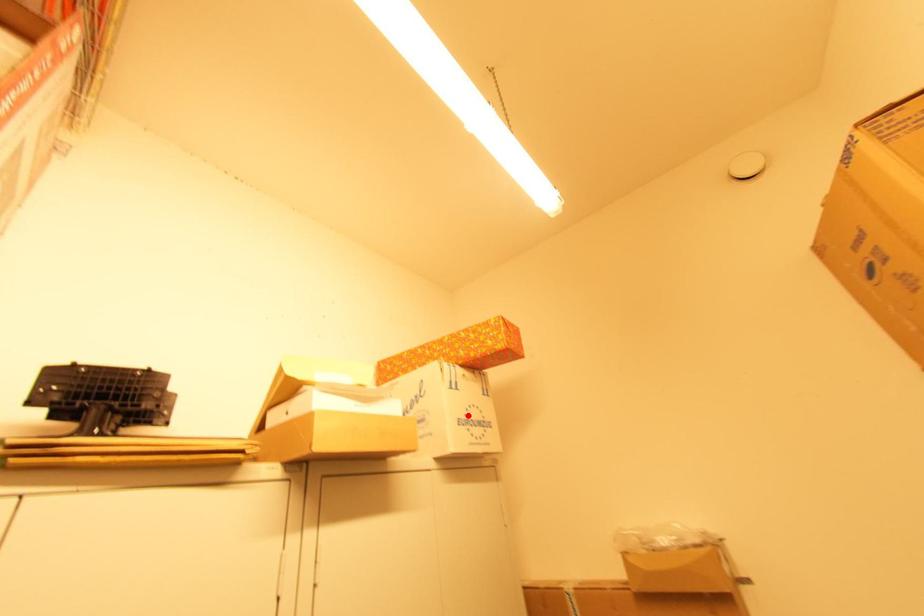
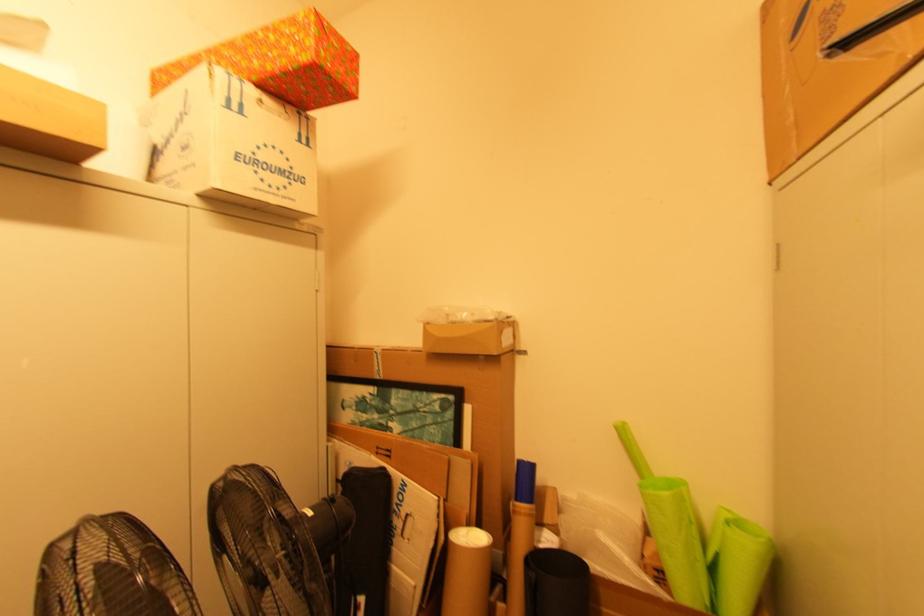
Where in the second image is the point corresponding to the highlighted location from the first image?

(257, 154)